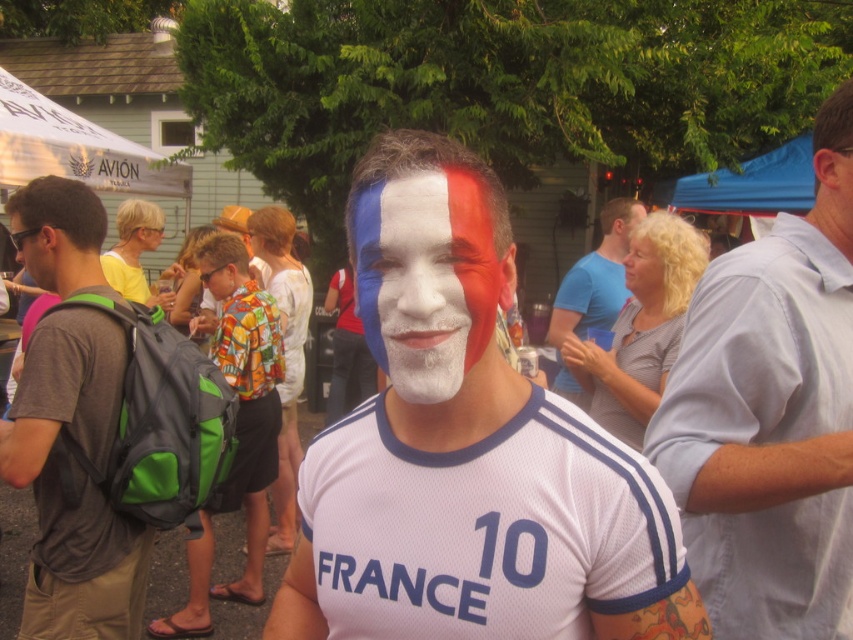
Is matte white face paint at center in front of matte black sunglasses at left?

Yes, matte white face paint at center is closer to the viewer.

Is point (404, 192) less distant than point (22, 288)?

Yes.

Who is more distant from viewer, (329, 515) or (28, 289)?

The point (28, 289) is behind.

I want to click on matte white face paint at center, so click(x=467, y=451).

Which of these two, smooth blonde hair at upper right or matte white face at center, stands taller?

With more height is smooth blonde hair at upper right.

Is smooth blonde hair at upper right positioned at the back of matte white face at center?

No.

What are the coordinates of `smooth blonde hair at upper right` in the screenshot? It's located at (643, 268).

The image size is (853, 640). I want to click on smooth blonde hair at upper right, so click(643, 268).

Can you confirm if matte paint face at center is taller than white matte face paint at center?

Incorrect, matte paint face at center's height is not larger of white matte face paint at center's.

Can you confirm if matte paint face at center is shorter than white matte face paint at center?

Indeed, matte paint face at center has a lesser height compared to white matte face paint at center.

Does point (368, 234) lie behind point (641, 218)?

That is False.

At what (x,y) coordinates should I click in order to perform the action: click on matte paint face at center. Please return your answer as a coordinate pair (x, y). This screenshot has height=640, width=853. Looking at the image, I should click on (424, 280).